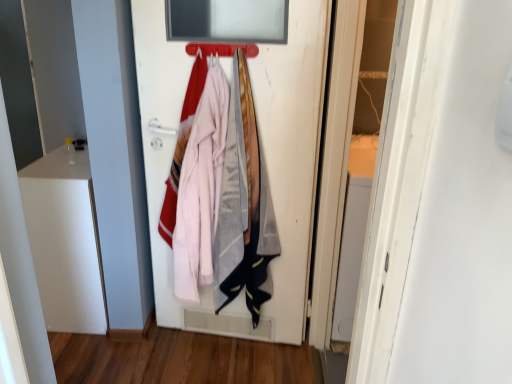
Question: Is white matte door at center taller or shorter than metallic silver hanger at upper center?

Choices:
 (A) tall
 (B) short

Answer: (A)

Question: In the image, is white matte door at center positioned in front of or behind metallic silver hanger at upper center?

Choices:
 (A) behind
 (B) front

Answer: (B)

Question: From a real-world perspective, is white matte door at center above or below metallic silver hanger at upper center?

Choices:
 (A) below
 (B) above

Answer: (A)

Question: Would you say metallic silver hanger at upper center is inside or outside white matte door at center?

Choices:
 (A) outside
 (B) inside

Answer: (A)

Question: Considering the positions of metallic silver hanger at upper center and white matte door at center in the image, is metallic silver hanger at upper center wider or thinner than white matte door at center?

Choices:
 (A) wide
 (B) thin

Answer: (A)

Question: Considering the relative positions of metallic silver hanger at upper center and white matte door at center in the image provided, is metallic silver hanger at upper center to the left or to the right of white matte door at center?

Choices:
 (A) right
 (B) left

Answer: (B)

Question: Is point (218, 49) positioned closer to the camera than point (161, 269)?

Choices:
 (A) farther
 (B) closer

Answer: (B)